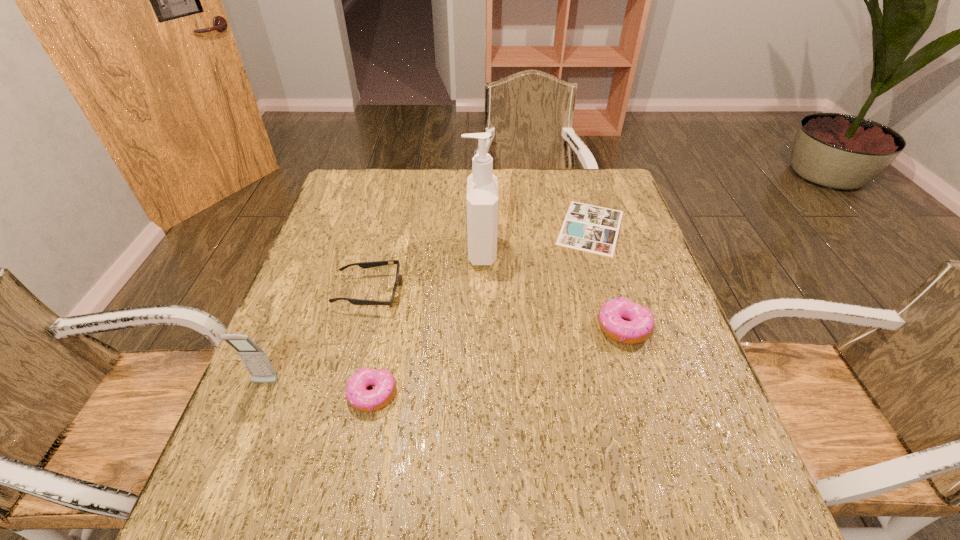
At what (x,y) coordinates should I click in order to perform the action: click on the shorter doughnut. Please return your answer as a coordinate pair (x, y). This screenshot has height=540, width=960. Looking at the image, I should click on (357, 395).

This screenshot has height=540, width=960. What are the coordinates of `the left doughnut` in the screenshot? It's located at (357, 395).

This screenshot has height=540, width=960. What are the coordinates of `the farther doughnut` in the screenshot? It's located at (640, 325).

Find the location of a particular element. This screenshot has height=540, width=960. the taller doughnut is located at coordinates (640, 325).

Where is `the tallest object`? The image size is (960, 540). the tallest object is located at coordinates (482, 205).

Where is `the third object from right to left`? This screenshot has height=540, width=960. the third object from right to left is located at coordinates (482, 205).

Locate an element on the screen. book is located at coordinates (588, 228).

You are a GUI agent. You are given a task and a screenshot of the screen. Output one action in this format:
    pyautogui.click(x=<x>, y=<y>)
    Task: Click on the cellular telephone
    
    Given the screenshot: What is the action you would take?
    pyautogui.click(x=254, y=358)

Locate an element on the screen. The width and height of the screenshot is (960, 540). the leftmost object is located at coordinates (254, 358).

Locate an element on the screen. sunglasses is located at coordinates (364, 265).